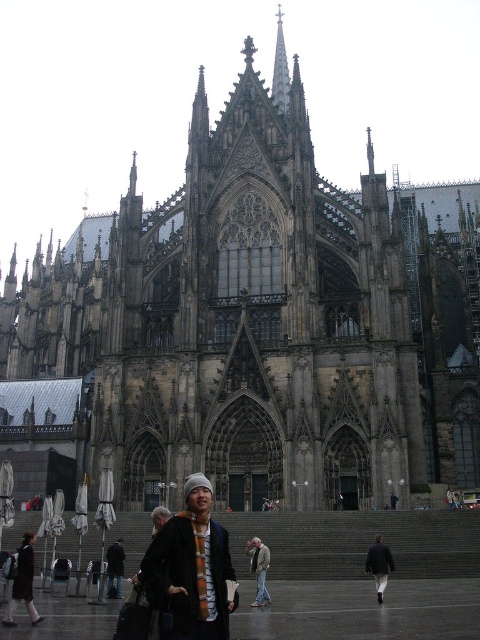
Question: Can you confirm if dark gray stone spire at upper center is positioned to the right of dark gray wool coat at lower right?

Choices:
 (A) yes
 (B) no

Answer: (B)

Question: Which object is farther from the camera taking this photo?

Choices:
 (A) knitted wool hat at center
 (B) orange scarf at lower left

Answer: (B)

Question: Can you confirm if dark gray wool coat at lower right is thinner than light gray jacket at center?

Choices:
 (A) no
 (B) yes

Answer: (A)

Question: Can you confirm if orange scarf at lower left is positioned above dark gray stone spire at upper center?

Choices:
 (A) no
 (B) yes

Answer: (A)

Question: Among these objects, which one is farthest from the camera?

Choices:
 (A) dark gray stone spire at upper center
 (B) dark gray knit hat at center
 (C) dark gray wool coat at lower right
 (D) knitted wool hat at center

Answer: (A)

Question: Which object appears closest to the camera in this image?

Choices:
 (A) orange scarf at lower left
 (B) dark gray knit hat at center

Answer: (A)